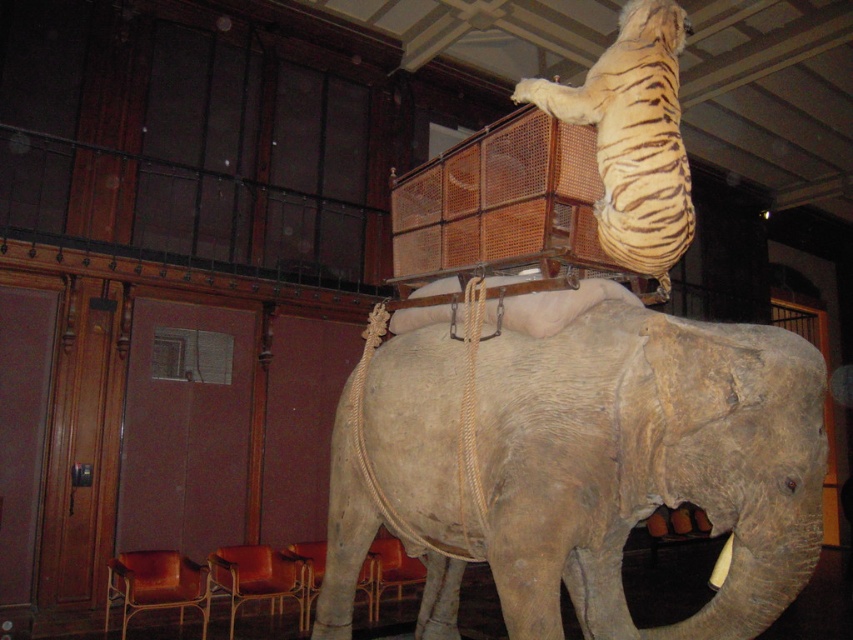
Question: Which point appears farthest from the camera in this image?

Choices:
 (A) (611, 308)
 (B) (656, 205)

Answer: (A)

Question: Does grayish-brown textured elephant at center appear under yellow and black striped fur at upper center?

Choices:
 (A) yes
 (B) no

Answer: (A)

Question: Which point is closer to the camera?

Choices:
 (A) (524, 481)
 (B) (670, 12)

Answer: (A)

Question: Is grayish-brown textured elephant at center bigger than yellow and black striped fur at upper center?

Choices:
 (A) no
 (B) yes

Answer: (B)

Question: Among these objects, which one is farthest from the camera?

Choices:
 (A) yellow and black striped fur at upper center
 (B) grayish-brown textured elephant at center

Answer: (A)

Question: Does grayish-brown textured elephant at center appear on the right side of yellow and black striped fur at upper center?

Choices:
 (A) yes
 (B) no

Answer: (B)